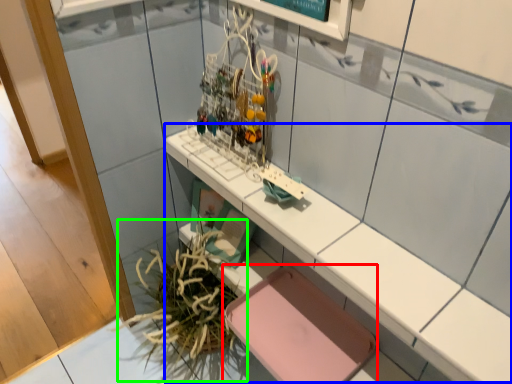
Question: Which object is the farthest from chair (highlighted by a red box)? Choose among these: counter (highlighted by a blue box) or plant (highlighted by a green box).

Choices:
 (A) counter
 (B) plant

Answer: (A)